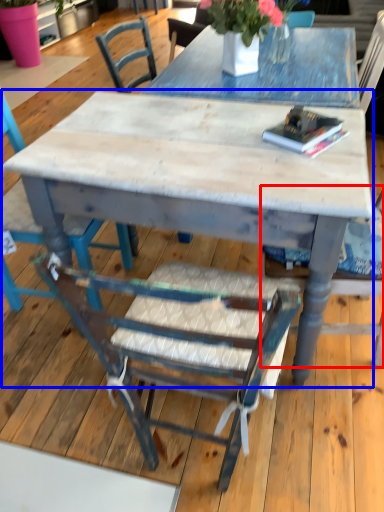
Question: Which object appears closest to the camera in this image, chair (highlighted by a red box) or kitchen & dining room table (highlighted by a blue box)?

Choices:
 (A) chair
 (B) kitchen & dining room table

Answer: (A)